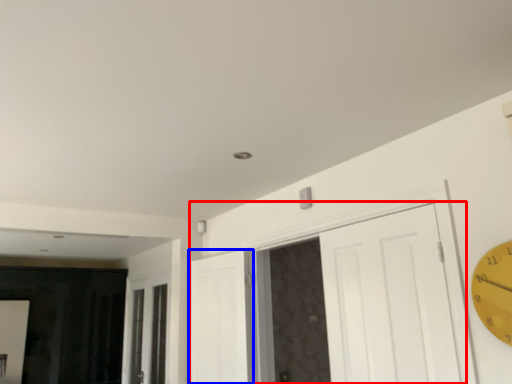
Question: Which object appears farthest to the camera in this image, door (highlighted by a red box) or door (highlighted by a blue box)?

Choices:
 (A) door
 (B) door

Answer: (B)